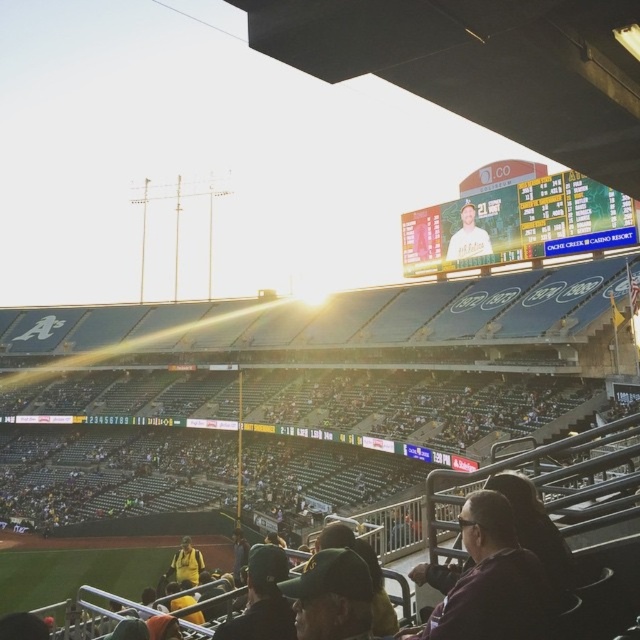
You are a photographer trying to capture both the purple fabric jacket at lower right and the yellow jersey at lower center in the same frame. Which object should you focus on first to ensure both are in the shot?

You should focus on the yellow jersey at lower center first because it is taller than the purple fabric jacket at lower right, ensuring both will be visible in the frame.

You are a photographer at the baseball stadium and want to capture both the purple fabric jacket at lower right and the yellow jersey at lower center in a single shot. Based on their positions, which one should you focus on first to ensure both are in frame?

The purple fabric jacket at lower right is located above the yellow jersey at lower center, so you should focus on the yellow jersey at lower center first to ensure both are in frame.